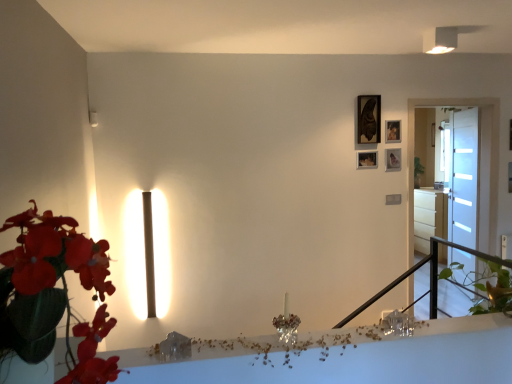
This screenshot has height=384, width=512. What do you see at coordinates (461, 175) in the screenshot?
I see `transparent glass door at right, positioned as the 2th glass door in back-to-front order` at bounding box center [461, 175].

You are a GUI agent. You are given a task and a screenshot of the screen. Output one action in this format:
    pyautogui.click(x=<x>, y=<y>)
    Task: Click on the matte black picture frame at upper right, the fourth picture frame when ordered from bottom to top
    The width and height of the screenshot is (512, 384).
    Given the screenshot: What is the action you would take?
    pyautogui.click(x=369, y=119)

Where is `white frosted glass door at right, placed as the 1th glass door when sorted from back to front`? This screenshot has height=384, width=512. white frosted glass door at right, placed as the 1th glass door when sorted from back to front is located at coordinates point(464,178).

At what (x,y) coordinates should I click in order to perform the action: click on wooden picture frame at upper right, the second picture frame positioned from the top. Please return your answer as a coordinate pair (x, y). This screenshot has width=512, height=384. Looking at the image, I should click on (392, 131).

What is the approximate height of matte black picture frame at upper right, the 1th picture frame ordered from the bottom?

It is 6.44 inches.

Measure the distance between clear glass table at center, the first table positioned from the left, and camera.

A distance of 1.52 meters exists between clear glass table at center, the first table positioned from the left, and camera.

From the picture: What is the approximate height of clear glass table at center, which is the second table in back-to-front order?

The height of clear glass table at center, which is the second table in back-to-front order, is 2.37 centimeters.

Measure the distance between wooden picture frame at upper right, which ranks as the third picture frame in top-to-bottom order, and camera.

wooden picture frame at upper right, which ranks as the third picture frame in top-to-bottom order, and camera are 3.96 meters apart.

Image resolution: width=512 pixels, height=384 pixels. Find the location of `transparent glass door at right, positioned as the 2th glass door in back-to-front order`. transparent glass door at right, positioned as the 2th glass door in back-to-front order is located at coordinates (461, 175).

Does point (290, 340) come behind point (415, 205)?

That is False.

This screenshot has width=512, height=384. I want to click on glass door that is the 1st one when counting backward from the crystal glass candle at center, so click(x=461, y=175).

Considering the sizes of objects crystal glass candle at center and transparent glass door at right, positioned as the 2th glass door in back-to-front order, in the image provided, who is smaller, crystal glass candle at center or transparent glass door at right, positioned as the 2th glass door in back-to-front order,?

Smaller between the two is crystal glass candle at center.

Could you tell me if crystal glass candle at center is turned towards transparent glass door at right, the 1th glass door from the front?

No, crystal glass candle at center is not oriented towards transparent glass door at right, the 1th glass door from the front.

The image size is (512, 384). What are the coordinates of `the 1st picture frame to the right of the black metal balustrade at center-right, counting from the anchor's position` in the screenshot? It's located at (369, 119).

Can you confirm if black metal balustrade at center-right is bigger than matte black picture frame at upper right, the fourth picture frame when ordered from bottom to top?

Correct, black metal balustrade at center-right is larger in size than matte black picture frame at upper right, the fourth picture frame when ordered from bottom to top.

Looking at their sizes, would you say black metal balustrade at center-right is wider or thinner than matte black picture frame at upper right, the fourth picture frame when ordered from bottom to top?

In the image, black metal balustrade at center-right appears to be wider than matte black picture frame at upper right, the fourth picture frame when ordered from bottom to top.

Can you confirm if black metal balustrade at center-right is shorter than matte black picture frame at upper right, which is the 1th picture frame in top-to-bottom order?

No.

In terms of width, does black metal balustrade at center-right look wider or thinner when compared to clear glass table at center, the second table in the top-to-bottom sequence?

black metal balustrade at center-right is wider than clear glass table at center, the second table in the top-to-bottom sequence.

Find the location of `table that is in front of the black metal balustrade at center-right`. table that is in front of the black metal balustrade at center-right is located at coordinates (343, 357).

Considering the positions of objects black metal balustrade at center-right and clear glass table at center, which is the 2th table from right to left, in the image provided, who is more to the right, black metal balustrade at center-right or clear glass table at center, which is the 2th table from right to left,?

black metal balustrade at center-right is more to the right.

Which of these two, black metal balustrade at center-right or clear glass table at center, the second table in the top-to-bottom sequence, is bigger?

With larger size is black metal balustrade at center-right.

Between transparent glass door at right, positioned as the 2th glass door in back-to-front order, and white frosted glass door at right, acting as the 2th glass door starting from the front, which one has larger size?

Bigger between the two is transparent glass door at right, positioned as the 2th glass door in back-to-front order.

Looking at their sizes, would you say transparent glass door at right, the 1th glass door from the front, is wider or thinner than white frosted glass door at right, placed as the 1th glass door when sorted from back to front?

In the image, transparent glass door at right, the 1th glass door from the front, appears to be wider than white frosted glass door at right, placed as the 1th glass door when sorted from back to front.

Is transparent glass door at right, positioned as the 2th glass door in back-to-front order, oriented towards white frosted glass door at right, placed as the 1th glass door when sorted from back to front?

No, transparent glass door at right, positioned as the 2th glass door in back-to-front order, is not oriented towards white frosted glass door at right, placed as the 1th glass door when sorted from back to front.

Is transparent glass door at right, positioned as the 2th glass door in back-to-front order, placed right next to white frosted glass door at right, acting as the 2th glass door starting from the front?

No, transparent glass door at right, positioned as the 2th glass door in back-to-front order, is not next to white frosted glass door at right, acting as the 2th glass door starting from the front.

Could you tell me if white glossy drawer at right, which appears as the 2th table when viewed from the front, is turned towards transparent glass door at right, positioned as the 2th glass door in back-to-front order?

No, white glossy drawer at right, which appears as the 2th table when viewed from the front, is not aimed at transparent glass door at right, positioned as the 2th glass door in back-to-front order.

Looking at this image, can you tell me how much white glossy drawer at right, which ranks as the second table in left-to-right order, and transparent glass door at right, the 1th glass door from the front, differ in facing direction?

90.2 degrees separate the facing orientations of white glossy drawer at right, which ranks as the second table in left-to-right order, and transparent glass door at right, the 1th glass door from the front.

Who is more distant, white glossy drawer at right, marked as the 1th table in a top-to-bottom arrangement, or transparent glass door at right, positioned as the 2th glass door in back-to-front order?

white glossy drawer at right, marked as the 1th table in a top-to-bottom arrangement.

From a real-world perspective, who is located higher, white glossy drawer at right, which ranks as the second table in left-to-right order, or transparent glass door at right, the 1th glass door from the front?

transparent glass door at right, the 1th glass door from the front.

Considering the relative positions of clear glass table at center, the 1th table ordered from the bottom, and matte black picture frame at upper right, the fourth picture frame when ordered from bottom to top, in the image provided, is clear glass table at center, the 1th table ordered from the bottom, behind matte black picture frame at upper right, the fourth picture frame when ordered from bottom to top,?

No, the depth of clear glass table at center, the 1th table ordered from the bottom, is less than that of matte black picture frame at upper right, the fourth picture frame when ordered from bottom to top.

Are clear glass table at center, which is the 2th table from right to left, and matte black picture frame at upper right, the fourth picture frame when ordered from bottom to top, beside each other?

No, clear glass table at center, which is the 2th table from right to left, is not next to matte black picture frame at upper right, the fourth picture frame when ordered from bottom to top.

Looking at this image, which is nearer, (x=390, y=377) or (x=375, y=126)?

Point (x=390, y=377).

How different are the orientations of clear glass table at center, which is the 2th table from right to left, and matte black picture frame at upper right, which is the 1th picture frame in top-to-bottom order, in degrees?

0.0015 degrees separate the facing orientations of clear glass table at center, which is the 2th table from right to left, and matte black picture frame at upper right, which is the 1th picture frame in top-to-bottom order.

Is white glossy drawer at right, acting as the 2th table starting from the bottom, positioned with its back to matte black picture frame at upper right, which is the 1th picture frame in top-to-bottom order?

No, white glossy drawer at right, acting as the 2th table starting from the bottom,'s orientation is not away from matte black picture frame at upper right, which is the 1th picture frame in top-to-bottom order.

Can you confirm if white glossy drawer at right, the 1th table in the right-to-left sequence, is thinner than matte black picture frame at upper right, which is the 1th picture frame in top-to-bottom order?

No, white glossy drawer at right, the 1th table in the right-to-left sequence, is not thinner than matte black picture frame at upper right, which is the 1th picture frame in top-to-bottom order.

From a real-world perspective, is white glossy drawer at right, the 1th table in the right-to-left sequence, physically above matte black picture frame at upper right, the fourth picture frame when ordered from bottom to top?

No, from a real-world perspective, white glossy drawer at right, the 1th table in the right-to-left sequence, is not over matte black picture frame at upper right, the fourth picture frame when ordered from bottom to top

Would you say white glossy drawer at right, which ranks as the second table in left-to-right order, is a long distance from matte black picture frame at upper right, which is the 1th picture frame in top-to-bottom order?

Yes, white glossy drawer at right, which ranks as the second table in left-to-right order, is far from matte black picture frame at upper right, which is the 1th picture frame in top-to-bottom order.

Where is `the 1st glass door behind the crystal glass candle at center`? the 1st glass door behind the crystal glass candle at center is located at coordinates (461, 175).

The width and height of the screenshot is (512, 384). Find the location of `balustrade below the matte black picture frame at upper right, which is the 1th picture frame in top-to-bottom order (from the image's perspective)`. balustrade below the matte black picture frame at upper right, which is the 1th picture frame in top-to-bottom order (from the image's perspective) is located at coordinates (430, 277).

Looking at the image, which one is located further to matte black picture frame at upper right, the fourth picture frame when ordered from bottom to top, transparent glass door at right, positioned as the 2th glass door in back-to-front order, or wooden picture frame at upper right, the 3th picture frame from the bottom?

transparent glass door at right, positioned as the 2th glass door in back-to-front order, is positioned further to the anchor matte black picture frame at upper right, the fourth picture frame when ordered from bottom to top.

Which object lies nearer to the anchor point white glossy drawer at right, which appears as the 2th table when viewed from the front, white frosted glass door at right, placed as the 1th glass door when sorted from back to front, or crystal glass candle at center?

Among the two, white frosted glass door at right, placed as the 1th glass door when sorted from back to front, is located nearer to white glossy drawer at right, which appears as the 2th table when viewed from the front.

Estimate the real-world distances between objects in this image. Which object is closer to white glossy drawer at right, which ranks as the second table in left-to-right order, white frosted glass door at right, placed as the 1th glass door when sorted from back to front, or wooden picture frame at upper right, the second picture frame positioned from the top?

Among the two, white frosted glass door at right, placed as the 1th glass door when sorted from back to front, is located nearer to white glossy drawer at right, which ranks as the second table in left-to-right order.

From the image, which object appears to be farther from transparent glass door at right, positioned as the 2th glass door in back-to-front order, leather-like green plant at left or white glossy drawer at right, marked as the 1th table in a top-to-bottom arrangement?

The object further to transparent glass door at right, positioned as the 2th glass door in back-to-front order, is leather-like green plant at left.

Estimate the real-world distances between objects in this image. Which object is closer to white glossy drawer at right, the 1th table in the right-to-left sequence, matte black picture frame at upper right, arranged as the fourth picture frame when viewed from the top, or clear glass table at center, which appears as the 1th table when viewed from the front?

Based on the image, matte black picture frame at upper right, arranged as the fourth picture frame when viewed from the top, appears to be nearer to white glossy drawer at right, the 1th table in the right-to-left sequence.

When comparing their distances from white glossy drawer at right, acting as the 2th table starting from the bottom, does transparent glass door at right, the 1th glass door from the front, or white frosted glass door at right, placed as the 1th glass door when sorted from back to front, seem closer?

The object closer to white glossy drawer at right, acting as the 2th table starting from the bottom, is transparent glass door at right, the 1th glass door from the front.

Looking at the image, which one is located further to crystal glass candle at center, wooden picture frame at upper right, which ranks as the third picture frame in top-to-bottom order, or wooden picture frame at upper right, the 3th picture frame from the bottom?

wooden picture frame at upper right, the 3th picture frame from the bottom, is positioned further to the anchor crystal glass candle at center.

Considering their positions, is white glossy drawer at right, which ranks as the second table in left-to-right order, positioned closer to clear glass table at center, the second table in the top-to-bottom sequence, than matte black picture frame at upper right, arranged as the fourth picture frame when viewed from the top?

matte black picture frame at upper right, arranged as the fourth picture frame when viewed from the top, is positioned closer to the anchor clear glass table at center, the second table in the top-to-bottom sequence.

This screenshot has height=384, width=512. Find the location of `candle holder between leather-like green plant at left and wooden picture frame at upper right, the 3th picture frame from the bottom, from front to back`. candle holder between leather-like green plant at left and wooden picture frame at upper right, the 3th picture frame from the bottom, from front to back is located at coordinates (287, 324).

Identify the location of table located between leather-like green plant at left and matte black picture frame at upper right, the 1th picture frame ordered from the bottom, in the depth direction. The height and width of the screenshot is (384, 512). (343, 357).

Where is `candle holder between clear glass table at center, the 1th table ordered from the bottom, and wooden picture frame at upper right, arranged as the second picture frame when ordered from the bottom, along the z-axis`? candle holder between clear glass table at center, the 1th table ordered from the bottom, and wooden picture frame at upper right, arranged as the second picture frame when ordered from the bottom, along the z-axis is located at coordinates (287, 324).

The image size is (512, 384). What are the coordinates of `table between leather-like green plant at left and crystal glass candle at center in the front-back direction` in the screenshot? It's located at (343, 357).